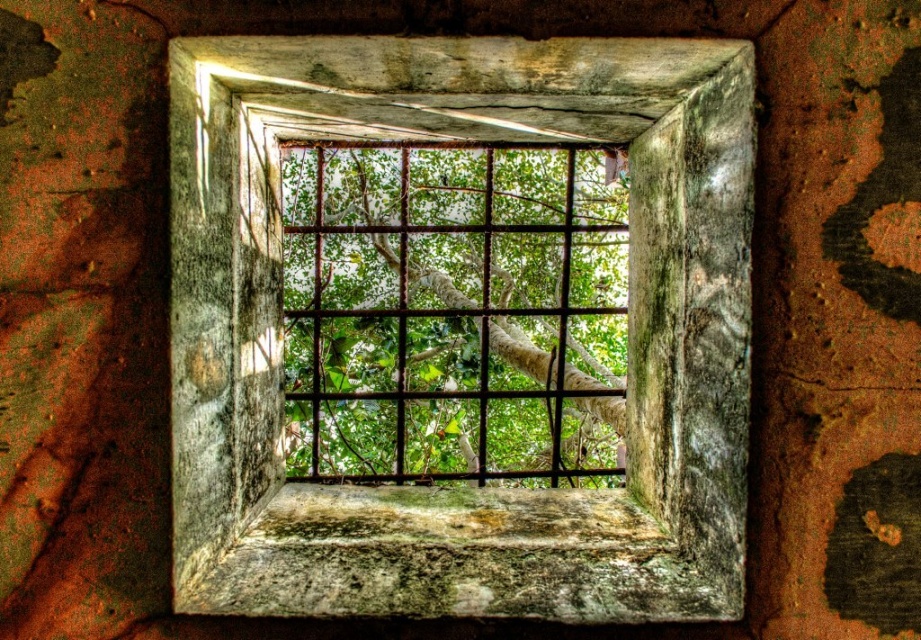
You are standing inside a building and looking through the rusty metal window frame at center. You want to reach out and touch the green leafy tree at center outside. Can you do this without moving your position?

The rusty metal window frame at center and green leafy tree at center are 3.63 meters apart. Since the distance is too far to reach, you cannot touch the green leafy tree at center from your current position.

You are an architect designing a new building and want to incorporate elements from this scene. If you want to emphasize the contrast between the rusty metal window frame at center and the green leafy tree at center, which element should you make thicker to highlight their difference?

To emphasize the contrast between the rusty metal window frame at center and the green leafy tree at center, you should make the green leafy tree at center thicker since the rusty metal window frame at center is already thinner than it.

You are an interior designer assessing a historic building. You notice the rusty metal window frame at center and the green leafy tree at center in the scene. Which object takes up more visual space in the window?

The green leafy tree at center occupies more visual space than the rusty metal window frame at center, as stated in the description.